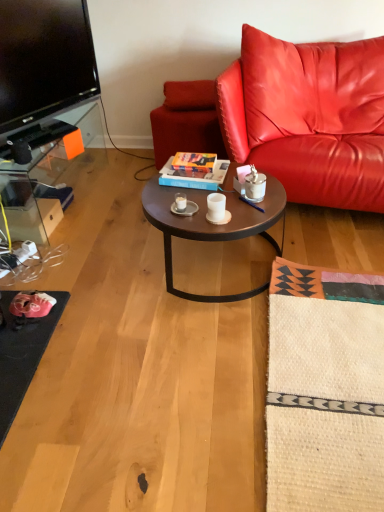
Question: Considering the relative sizes of white ceramic mug at center, the 2th coffee cup from the front, and leather couch at right in the image provided, is white ceramic mug at center, the 2th coffee cup from the front, bigger than leather couch at right?

Choices:
 (A) no
 (B) yes

Answer: (A)

Question: Can you confirm if white ceramic mug at center, the 2th coffee cup from the front, is positioned to the left of leather couch at right?

Choices:
 (A) yes
 (B) no

Answer: (A)

Question: Is white ceramic mug at center, which appears as the 2th coffee cup when viewed from the right, positioned beyond the bounds of leather couch at right?

Choices:
 (A) yes
 (B) no

Answer: (A)

Question: Considering the relative sizes of white ceramic mug at center, which appears as the 2th coffee cup when viewed from the right, and leather couch at right in the image provided, is white ceramic mug at center, which appears as the 2th coffee cup when viewed from the right, thinner than leather couch at right?

Choices:
 (A) yes
 (B) no

Answer: (A)

Question: Are white ceramic mug at center, which is the 1th coffee cup in back-to-front order, and leather couch at right far apart?

Choices:
 (A) no
 (B) yes

Answer: (A)

Question: Is metallic pen at center to the left or to the right of matte leather swivel chair at center in the image?

Choices:
 (A) left
 (B) right

Answer: (B)

Question: Considering their positions, is metallic pen at center located in front of or behind matte leather swivel chair at center?

Choices:
 (A) behind
 (B) front

Answer: (B)

Question: From a real-world perspective, is metallic pen at center physically located above or below matte leather swivel chair at center?

Choices:
 (A) below
 (B) above

Answer: (B)

Question: Is point (243, 198) closer or farther from the camera than point (190, 130)?

Choices:
 (A) farther
 (B) closer

Answer: (B)

Question: From the image's perspective, is metallic pen at center positioned above or below white matte cup at center, arranged as the 1th coffee cup when viewed from the front?

Choices:
 (A) below
 (B) above

Answer: (B)

Question: From a real-world perspective, relative to white matte cup at center, arranged as the 1th coffee cup when viewed from the front, is metallic pen at center vertically above or below?

Choices:
 (A) above
 (B) below

Answer: (B)

Question: Looking at the image, does metallic pen at center seem bigger or smaller compared to white matte cup at center, which is counted as the first coffee cup, starting from the right?

Choices:
 (A) big
 (B) small

Answer: (B)

Question: Considering the positions of point (246, 200) and point (218, 208), is point (246, 200) closer or farther from the camera than point (218, 208)?

Choices:
 (A) closer
 (B) farther

Answer: (B)

Question: Is point (185, 195) positioned closer to the camera than point (198, 100)?

Choices:
 (A) closer
 (B) farther

Answer: (A)

Question: Is white ceramic mug at center, which ranks as the 1th coffee cup in left-to-right order, wider or thinner than leather cushion at upper center?

Choices:
 (A) thin
 (B) wide

Answer: (A)